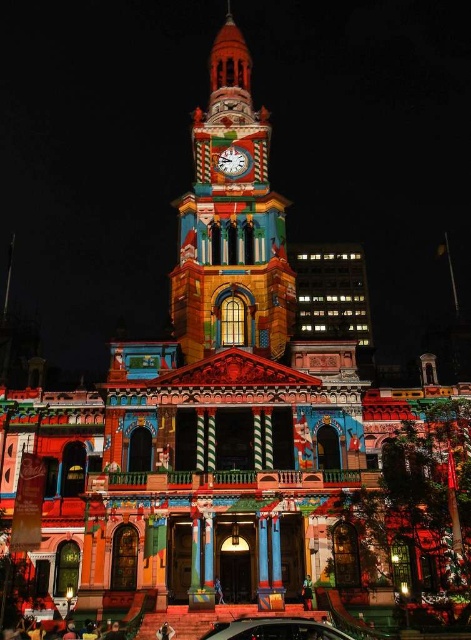
You are an architect analyzing the lighting design of the multicolored mosaic clock tower at center and the metallic silver clock at center. Which object is closer to the viewer?

The multicolored mosaic clock tower at center is closer to the viewer because it is in front of the metallic silver clock at center.

You are standing at the base of the clock tower and see two points marked on the tower. The first point is at coordinates point [222,227] and the second is at point [306,627]. Which point is closer to the top of the tower?

Point [222,227] is behind point [306,627], so the point closer to the top of the tower is point [306,627].